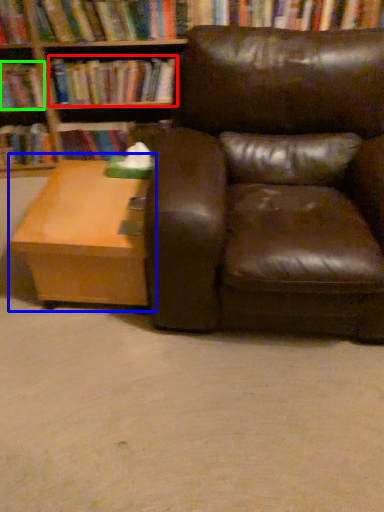
Question: Based on their relative distances, which object is nearer to book (highlighted by a red box)? Choose from table (highlighted by a blue box) and book (highlighted by a green box).

Choices:
 (A) table
 (B) book

Answer: (B)